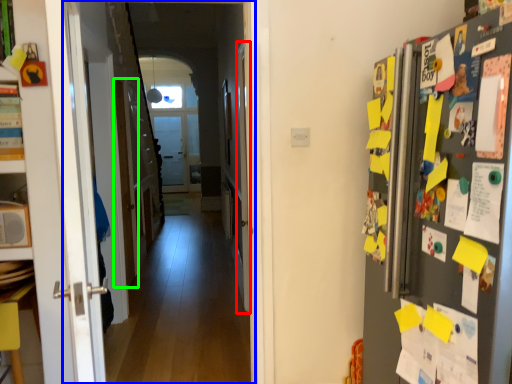
Question: Based on their relative distances, which object is nearer to door (highlighted by a red box)? Choose from corridor (highlighted by a blue box) and door (highlighted by a green box).

Choices:
 (A) corridor
 (B) door

Answer: (A)